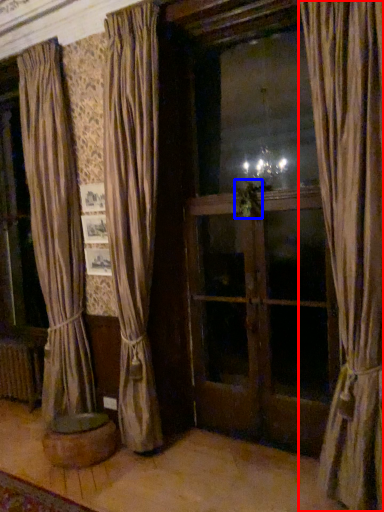
Question: Which object appears closest to the camera in this image, curtain (highlighted by a red box) or plant (highlighted by a blue box)?

Choices:
 (A) curtain
 (B) plant

Answer: (A)